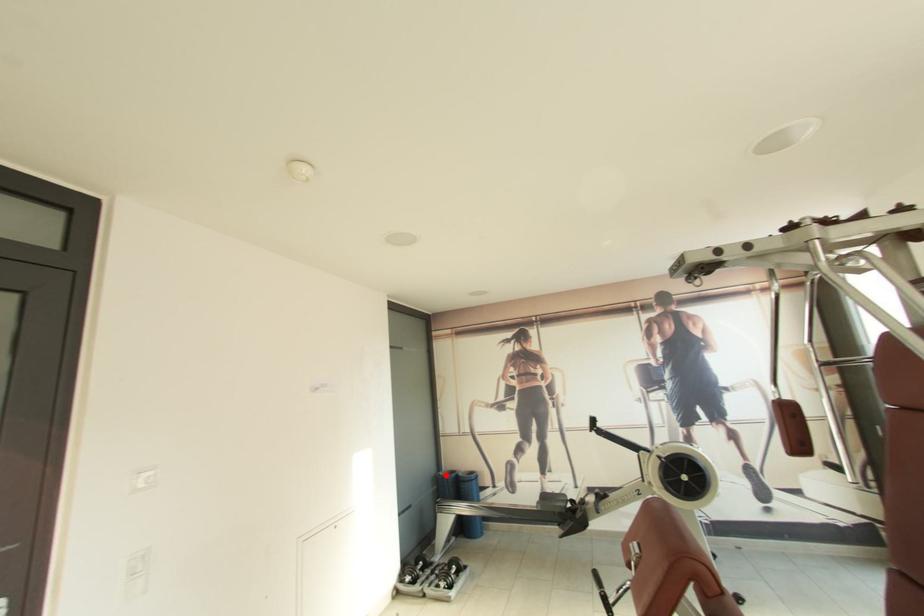
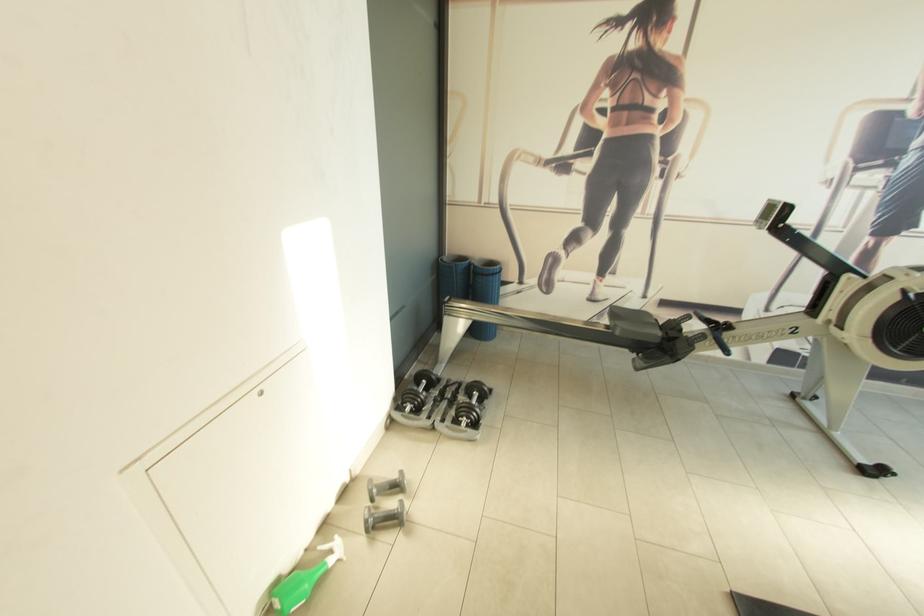
Locate, in the second image, the point that corresponds to the highlighted location in the first image.

(451, 261)